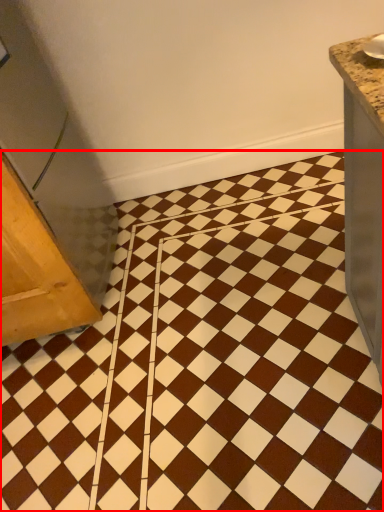
Question: From the image's perspective, where is ceramic tile (annotated by the red box) located relative to furniture?

Choices:
 (A) below
 (B) above

Answer: (B)